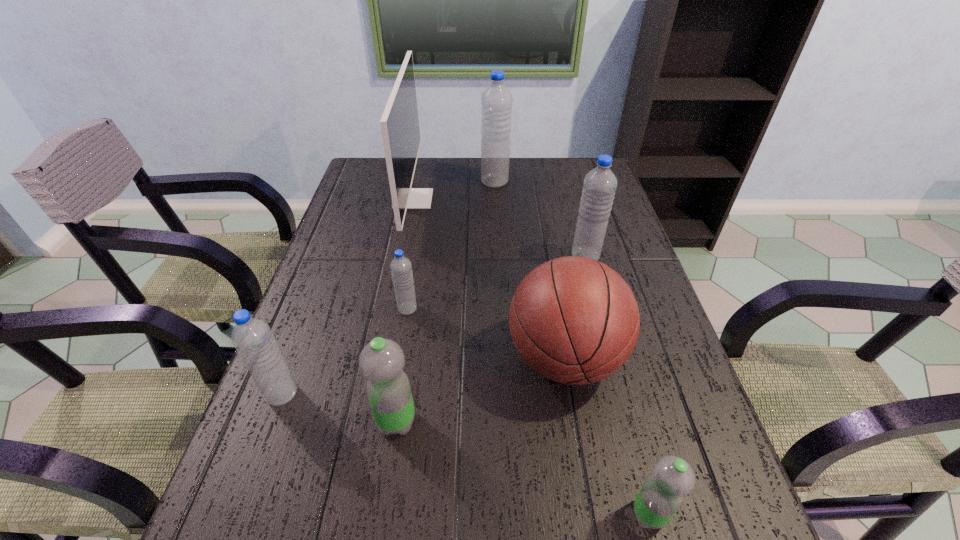
The image size is (960, 540). I want to click on black monitor, so click(399, 123).

The height and width of the screenshot is (540, 960). What are the coordinates of `the biggest blue water bottle` in the screenshot? It's located at [x=496, y=101].

I want to click on the third water bottle from right to left, so click(496, 101).

This screenshot has width=960, height=540. Find the location of `the sixth shortest object`. the sixth shortest object is located at coordinates (599, 185).

The height and width of the screenshot is (540, 960). Find the location of `the fifth nearest water bottle`. the fifth nearest water bottle is located at coordinates (599, 185).

Find the location of a particular element. This screenshot has height=540, width=960. basketball is located at coordinates [574, 320].

This screenshot has height=540, width=960. What are the coordinates of `the leftmost water bottle` in the screenshot? It's located at (255, 343).

You are a GUI agent. You are given a task and a screenshot of the screen. Output one action in this format:
    pyautogui.click(x=<x>, y=<y>)
    Task: Click on the leftmost object
    The width and height of the screenshot is (960, 540).
    Given the screenshot: What is the action you would take?
    pyautogui.click(x=255, y=343)

This screenshot has height=540, width=960. Find the location of `the left green water bottle`. the left green water bottle is located at coordinates (381, 361).

This screenshot has width=960, height=540. I want to click on the bigger green water bottle, so click(x=381, y=361).